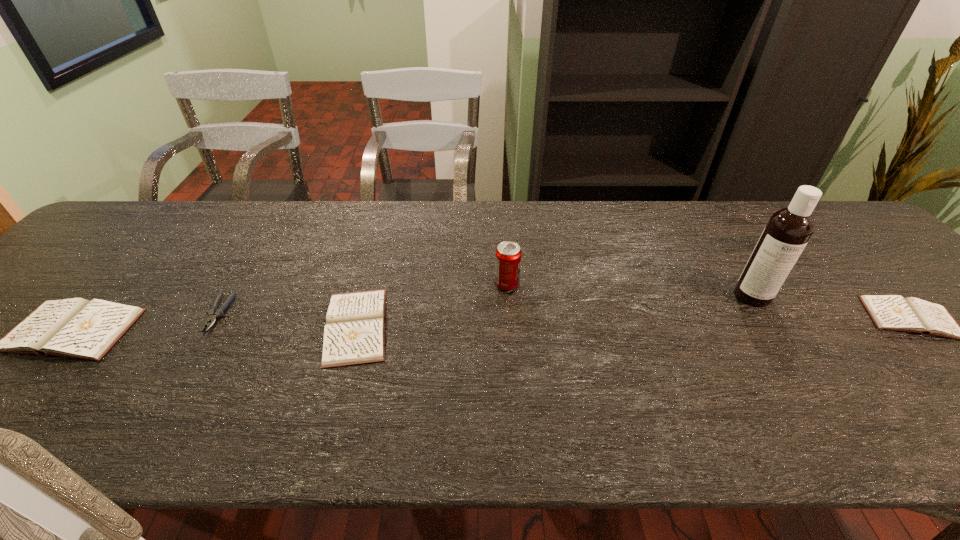
If equal spacing is desired by inserting an extra diary among them, please point out a free spot for this new diary. Please provide its 2D coordinates. Your answer should be formatted as a tuple, i.e. [(x, y)], where the tuple contains the x and y coordinates of a point satisfying the conditions above.

[(636, 322)]